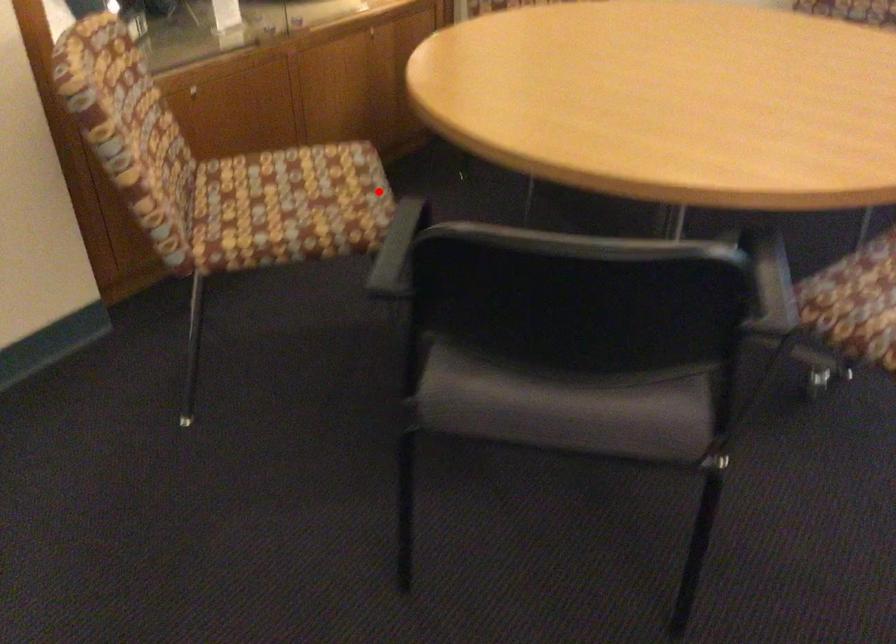
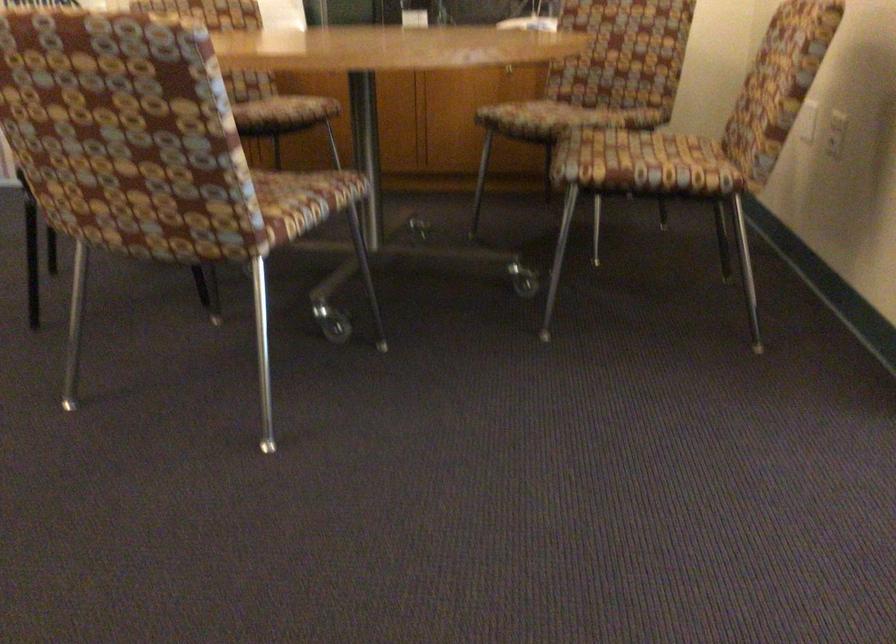
Question: I am providing you with two images of the same scene from different viewpoints. Image1 has a red point marked. In image2, the corresponding 3D location appears at what relative position? Reply with the corresponding letter.

Choices:
 (A) Closer
 (B) Farther

Answer: (B)